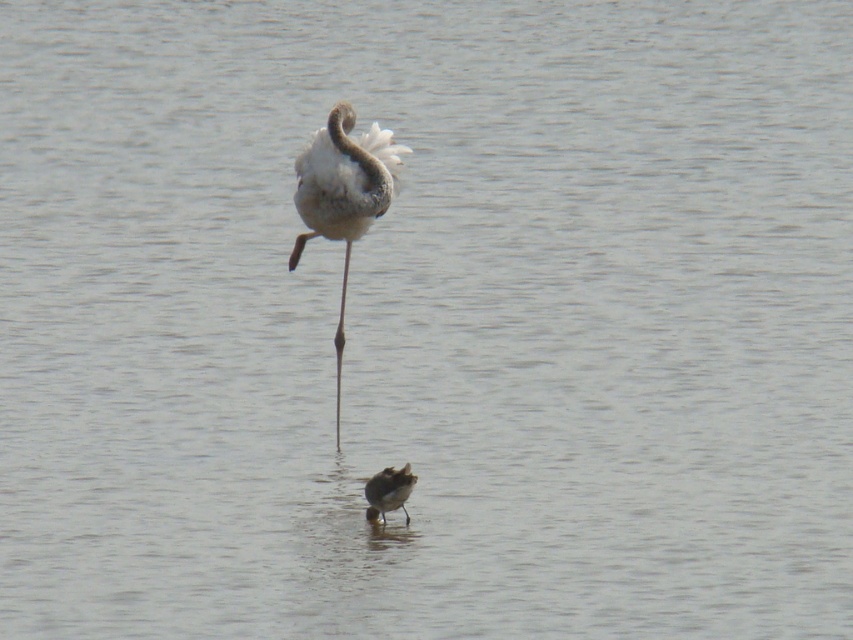
Consider the image. You are a photographer trying to capture both the white feathered bird at center and the brown speckled sandpiper at lower center in a single frame. Which bird will require more horizontal space in your camera viewfinder to avoid cropping?

The white feathered bird at center requires more horizontal space in the camera viewfinder because its width surpasses that of the brown speckled sandpiper at lower center.